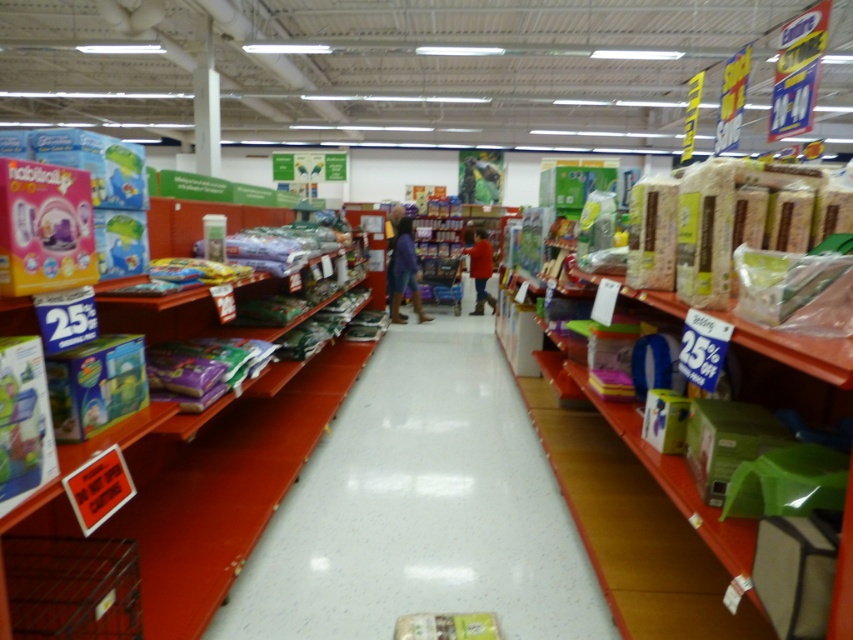
Can you confirm if shiny plastic aisle at center is smaller than red sweater at center?

Actually, shiny plastic aisle at center might be larger than red sweater at center.

Is point (503, 570) closer to viewer compared to point (474, 278)?

Yes, it is.

Locate an element on the screen. The height and width of the screenshot is (640, 853). shiny plastic aisle at center is located at coordinates (421, 508).

Which is more to the right, blue fabric pants at center or red sweater at center?

red sweater at center is more to the right.

Is blue fabric pants at center wider than red sweater at center?

Yes, blue fabric pants at center is wider than red sweater at center.

Between point (399, 273) and point (473, 257), which one is positioned in front?

Positioned in front is point (399, 273).

Where is `blue fabric pants at center`? blue fabric pants at center is located at coordinates (404, 273).

Looking at this image, which of these two, red sweater at center or dark brown leather jacket at center, stands taller?

With more height is dark brown leather jacket at center.

Is red sweater at center bigger than dark brown leather jacket at center?

No, red sweater at center is not bigger than dark brown leather jacket at center.

The height and width of the screenshot is (640, 853). Describe the element at coordinates (480, 269) in the screenshot. I see `red sweater at center` at that location.

In order to click on red sweater at center in this screenshot , I will do `click(480, 269)`.